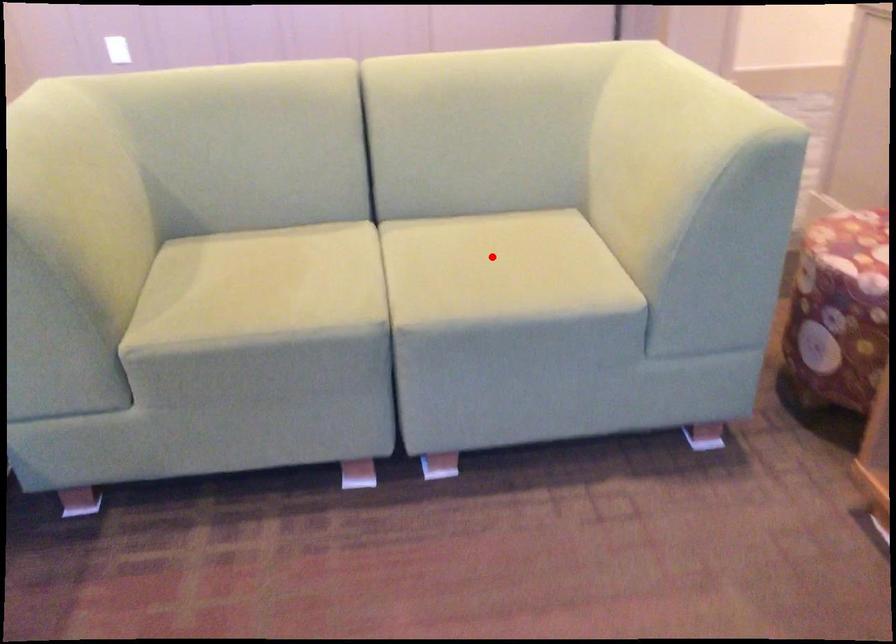
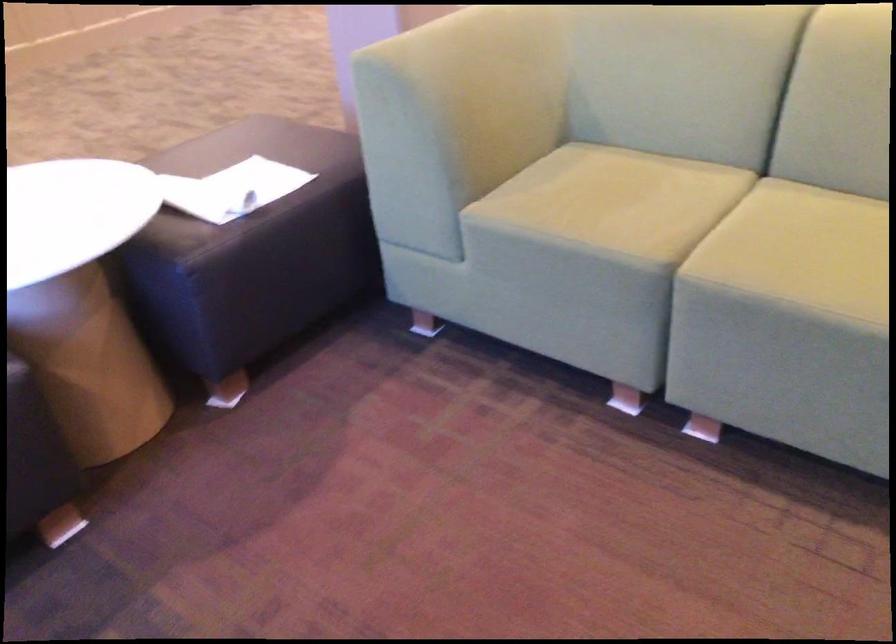
Question: I am providing you with two images of the same scene from different viewpoints. Image1 has a red point marked. In image2, the corresponding 3D location appears at what relative position? Reply with the corresponding letter.

Choices:
 (A) Closer
 (B) Farther

Answer: (A)